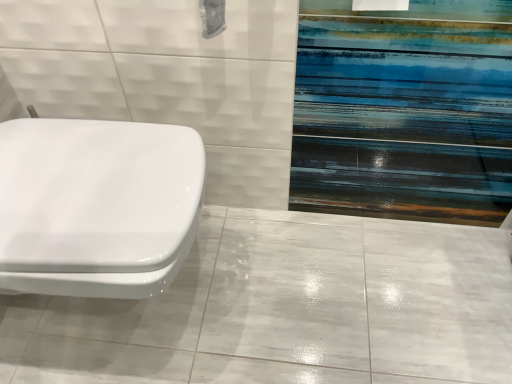
Question: Does white glossy toilet at left have a smaller size compared to white glossy tile at lower left?

Choices:
 (A) no
 (B) yes

Answer: (A)

Question: Does white glossy toilet at left turn towards white glossy tile at lower left?

Choices:
 (A) yes
 (B) no

Answer: (A)

Question: Considering the relative sizes of white glossy toilet at left and white glossy tile at lower left in the image provided, is white glossy toilet at left wider than white glossy tile at lower left?

Choices:
 (A) yes
 (B) no

Answer: (B)

Question: Is white glossy toilet at left to the right of white glossy tile at lower left from the viewer's perspective?

Choices:
 (A) yes
 (B) no

Answer: (B)

Question: From the image's perspective, is white glossy toilet at left located above white glossy tile at lower left?

Choices:
 (A) no
 (B) yes

Answer: (B)

Question: Is white glossy toilet at left taller than white glossy tile at lower left?

Choices:
 (A) no
 (B) yes

Answer: (B)

Question: Does white glossy tile at lower left have a larger size compared to white glossy toilet at left?

Choices:
 (A) no
 (B) yes

Answer: (A)

Question: Can white glossy toilet at left be found inside white glossy tile at lower left?

Choices:
 (A) yes
 (B) no

Answer: (B)

Question: Does white glossy tile at lower left have a smaller size compared to white glossy toilet at left?

Choices:
 (A) yes
 (B) no

Answer: (A)

Question: Is white glossy tile at lower left oriented away from white glossy toilet at left?

Choices:
 (A) no
 (B) yes

Answer: (A)

Question: Is the depth of white glossy tile at lower left less than that of white glossy toilet at left?

Choices:
 (A) no
 (B) yes

Answer: (A)

Question: Is white glossy tile at lower left facing towards white glossy toilet at left?

Choices:
 (A) yes
 (B) no

Answer: (B)

Question: Considering their positions, is white glossy tile at lower left located in front of or behind white glossy toilet at left?

Choices:
 (A) behind
 (B) front

Answer: (A)